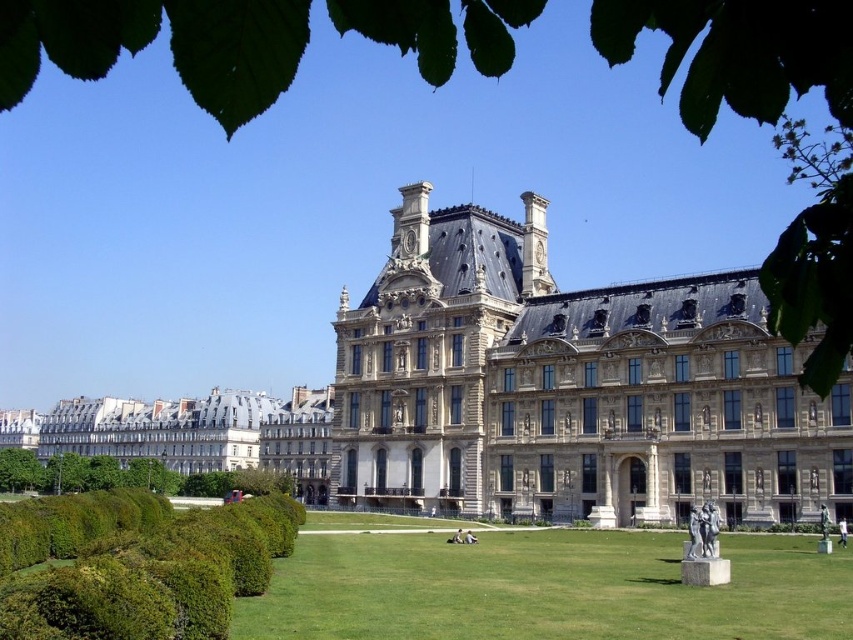
Question: Which object is farther from the camera taking this photo?

Choices:
 (A) green leafy hedge at lower left
 (B) white marble statue at lower right
 (C) green grass at center

Answer: (B)

Question: Considering the real-world distances, which object is closest to the green grass at center?

Choices:
 (A) white marble statue at lower right
 (B) green leafy hedge at lower left
 (C) beige stone palace at center

Answer: (A)

Question: Among these points, which one is farthest from the camera?

Choices:
 (A) (747, 572)
 (B) (599, 374)

Answer: (B)

Question: Is beige stone palace at center wider than white marble statue at lower right?

Choices:
 (A) yes
 (B) no

Answer: (A)

Question: Is green grass at center to the left of white marble statue at lower right from the viewer's perspective?

Choices:
 (A) yes
 (B) no

Answer: (A)

Question: Does green grass at center appear on the right side of green leafy hedge at lower left?

Choices:
 (A) yes
 (B) no

Answer: (A)